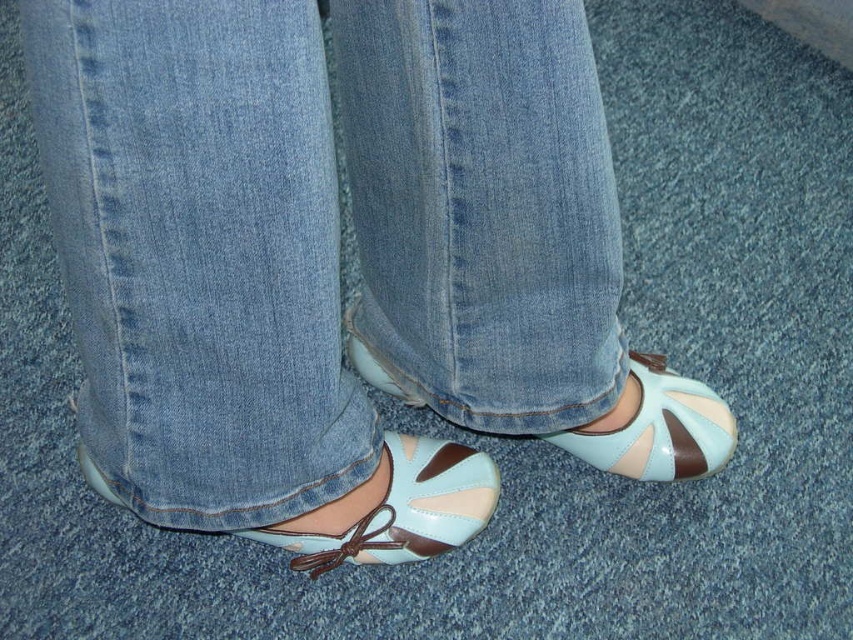
You are a photographer taking a close up shot of someone wearing light blue denim jeans at center and light blue patent leather sandal at center. Which item is positioned closer to the camera?

The light blue denim jeans at center is closer to the viewer than the light blue patent leather sandal at center, so the light blue denim jeans at center would be closer to the camera.

You are examining the shoes in the image. There are two points marked on the shoes. One is at coordinate point (450, 456) and the other is at point (358, 362). From the perspective of someone looking at the shoes, which point is closer to the viewer?

Point (450, 456) is in front of point (358, 362), so it is closer to the viewer.

You are a photographer setting up a shot of the light blue denim jeans at center. The camera is positioned to capture the jeans clearly. If you want to ensure the jeans are in focus, what distance should you set the camera lens to?

The light blue denim jeans at center is 27.18 inches away from camera, so you should set the camera lens to 27.18 inches to ensure the jeans are in focus.